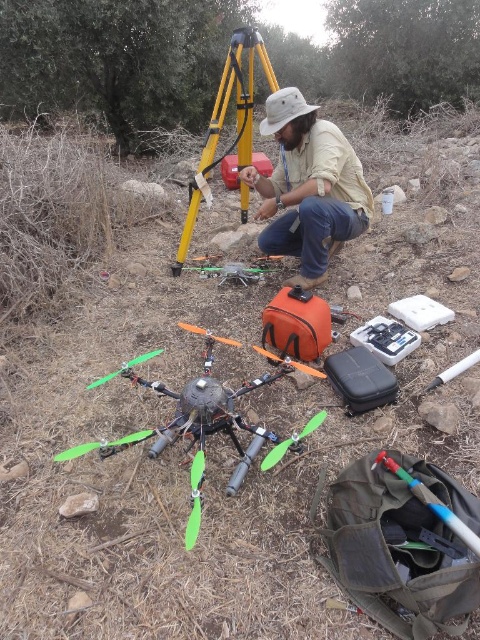
How much distance is there between khaki cotton shirt at center and yellow/yellowish metal tripod at center?

khaki cotton shirt at center and yellow/yellowish metal tripod at center are 21.62 inches apart from each other.

Which of these two, khaki cotton shirt at center or yellow/yellowish metal tripod at center, stands shorter?

With less height is khaki cotton shirt at center.

Is point (290, 227) positioned after point (247, 36)?

No, it is not.

Image resolution: width=480 pixels, height=640 pixels. I want to click on khaki cotton shirt at center, so click(x=309, y=188).

Is point (305, 115) less distant than point (208, 388)?

That is False.

Locate an element on the screen. The height and width of the screenshot is (640, 480). khaki cotton shirt at center is located at coordinates (309, 188).

Between point (252, 157) and point (312, 424), which one is positioned in front?

Point (312, 424) is in front.

Is point (224, 90) more distant than point (265, 461)?

Yes, it is behind point (265, 461).

Describe the element at coordinates (222, 128) in the screenshot. Image resolution: width=480 pixels, height=640 pixels. I see `yellow/yellowish metal tripod at center` at that location.

The image size is (480, 640). I want to click on yellow/yellowish metal tripod at center, so click(222, 128).